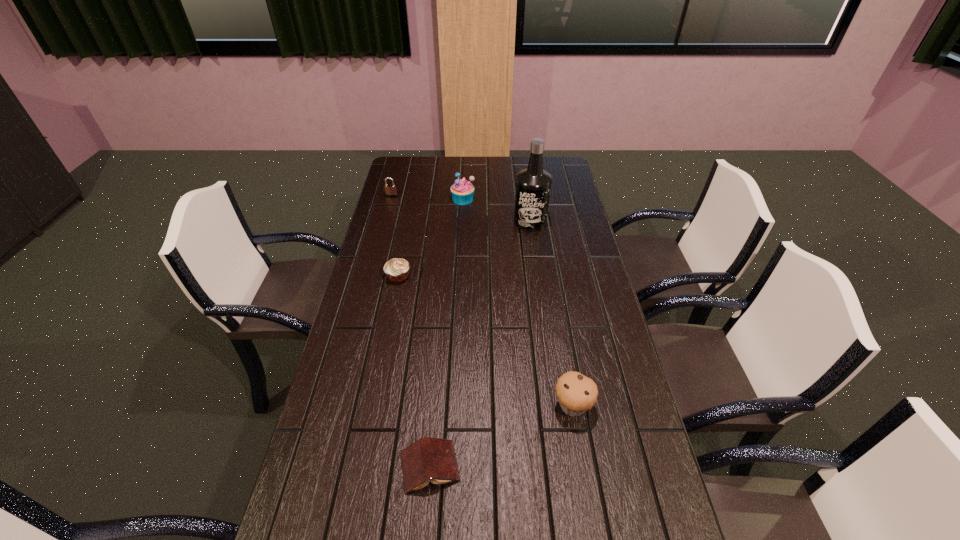
Identify the location of the third farthest object. (533, 184).

This screenshot has height=540, width=960. I want to click on the tallest object, so click(x=533, y=184).

Identify the location of the second muffin from left to right. The height and width of the screenshot is (540, 960). (462, 191).

Where is `the rightmost muffin`? The width and height of the screenshot is (960, 540). the rightmost muffin is located at coordinates (576, 393).

Image resolution: width=960 pixels, height=540 pixels. In order to click on the second nearest object in this screenshot , I will do tap(576, 393).

At what (x,y) coordinates should I click in order to perform the action: click on the fourth tallest object. Please return your answer as a coordinate pair (x, y). The height and width of the screenshot is (540, 960). Looking at the image, I should click on (390, 189).

The height and width of the screenshot is (540, 960). I want to click on the leftmost object, so click(x=390, y=189).

Identify the location of the fourth farthest object. (397, 269).

The width and height of the screenshot is (960, 540). Find the location of `the shortest muffin`. the shortest muffin is located at coordinates (397, 269).

I want to click on the nearest object, so click(x=428, y=459).